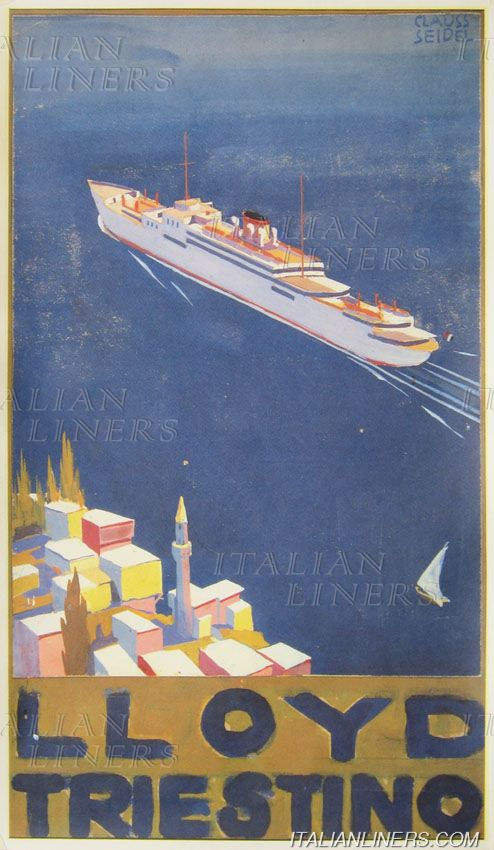
Image resolution: width=494 pixels, height=850 pixels. I want to click on poster, so click(x=292, y=717).